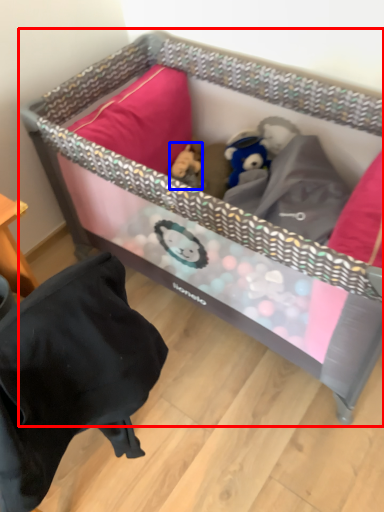
Question: Among these objects, which one is nearest to the camera, infant bed (highlighted by a red box) or toy (highlighted by a blue box)?

Choices:
 (A) infant bed
 (B) toy

Answer: (A)